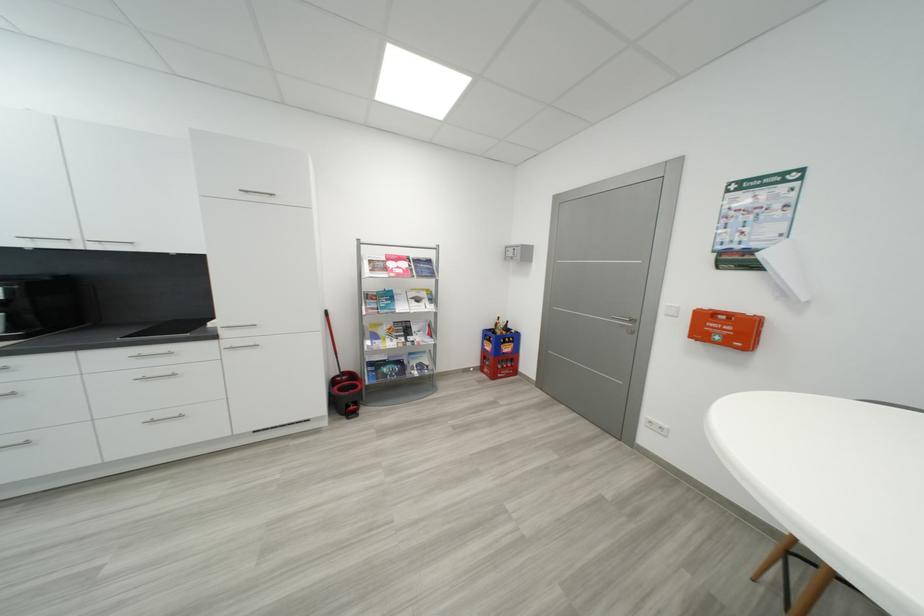
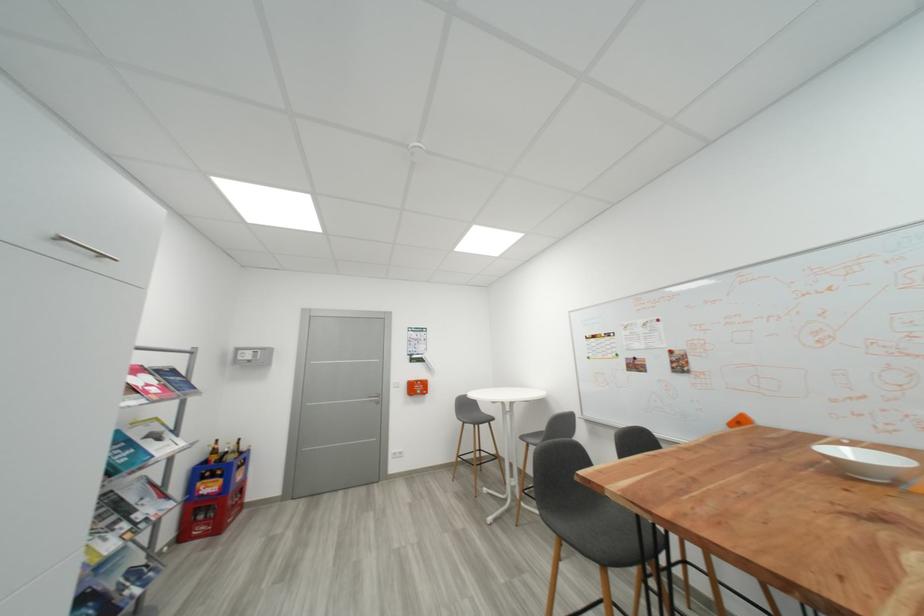
In the second image, find the point that corresponds to the point at 489,370 in the first image.

(189, 538)